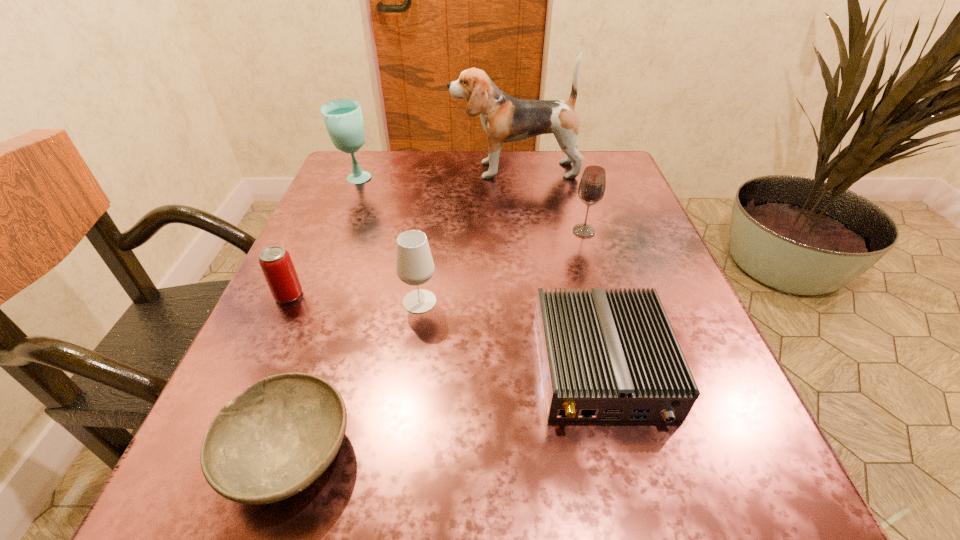
Find the location of `glass that is at the far edge`. glass that is at the far edge is located at coordinates (343, 118).

Find the location of a particular element. The image size is (960, 540). object that is at the near edge is located at coordinates (272, 441).

Find the location of a particular element. glass that is at the left edge is located at coordinates (343, 118).

Find the location of a particular element. This screenshot has width=960, height=540. beer can that is at the left edge is located at coordinates (276, 264).

The image size is (960, 540). In order to click on bowl positioned at the left edge in this screenshot , I will do `click(272, 441)`.

Find the location of a particular element. The image size is (960, 540). puppy that is at the right edge is located at coordinates (504, 118).

At what (x,y) coordinates should I click in order to perform the action: click on glass drink container that is at the right edge. Please return your answer as a coordinate pair (x, y). Image resolution: width=960 pixels, height=540 pixels. Looking at the image, I should click on tap(591, 189).

Where is `router present at the right edge`? The width and height of the screenshot is (960, 540). router present at the right edge is located at coordinates (605, 356).

Identify the location of object that is at the far left corner. This screenshot has width=960, height=540. (343, 118).

Locate an element on the screen. Image resolution: width=960 pixels, height=540 pixels. object that is at the near left corner is located at coordinates (272, 441).